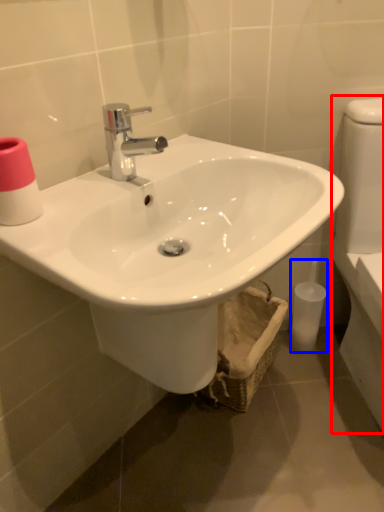
Question: Which object appears farthest to the camera in this image, porcelain (highlighted by a red box) or toiletry (highlighted by a blue box)?

Choices:
 (A) porcelain
 (B) toiletry

Answer: (B)